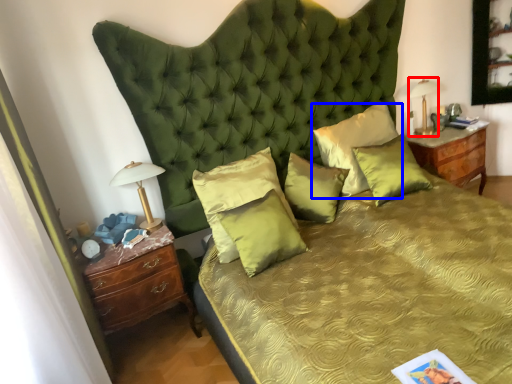
Question: Which object appears farthest to the camera in this image, bedside lamp (highlighted by a red box) or pillow (highlighted by a blue box)?

Choices:
 (A) bedside lamp
 (B) pillow

Answer: (A)